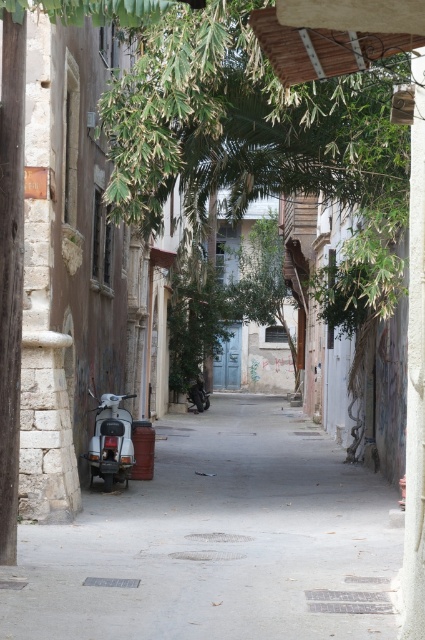
Can you confirm if white matte scooter at left is shorter than shiny black motorcycle at center?

Indeed, white matte scooter at left has a lesser height compared to shiny black motorcycle at center.

Is white matte scooter at left thinner than shiny black motorcycle at center?

Incorrect, white matte scooter at left's width is not less than shiny black motorcycle at center's.

Which is behind, point (286, 492) or point (198, 404)?

The point (198, 404) is more distant.

Locate an element on the screen. The width and height of the screenshot is (425, 640). white matte scooter at left is located at coordinates (218, 541).

Does white matte scooter at left appear on the left side of white matte scooter at lower left?

In fact, white matte scooter at left is to the right of white matte scooter at lower left.

Which is more to the left, white matte scooter at left or white matte scooter at lower left?

white matte scooter at lower left is more to the left.

The height and width of the screenshot is (640, 425). I want to click on white matte scooter at left, so click(218, 541).

The width and height of the screenshot is (425, 640). What are the coordinates of `white matte scooter at left` in the screenshot? It's located at (218, 541).

Which is more to the right, white matte scooter at lower left or shiny black motorcycle at center?

shiny black motorcycle at center

Does point (125, 436) come behind point (192, 396)?

That is False.

The image size is (425, 640). What are the coordinates of `white matte scooter at lower left` in the screenshot? It's located at (110, 442).